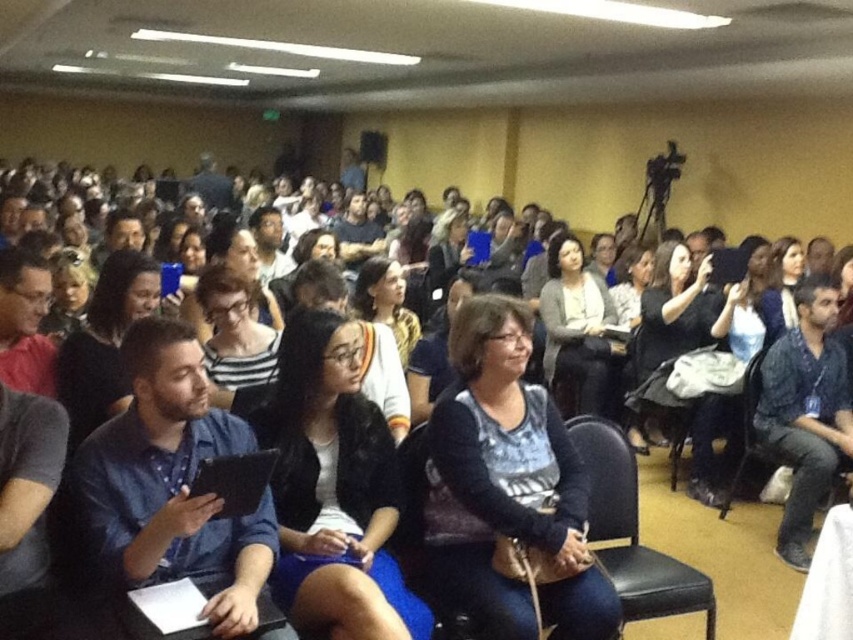
Question: Which of the following is the farthest from the observer?

Choices:
 (A) (651, 548)
 (B) (395, 324)
 (C) (109, 282)

Answer: (B)

Question: Is black fuzzy jacket at center positioned in front of black fabric at center?

Choices:
 (A) yes
 (B) no

Answer: (A)

Question: Which point is farther to the camera?

Choices:
 (A) (59, 381)
 (B) (207, 298)

Answer: (B)

Question: Which of the following is the closest to the observer?

Choices:
 (A) black fabric at center
 (B) dark gray sweater at center
 (C) striped shirt at center

Answer: (C)

Question: In this image, where is blue denim shirt at center located relative to black fabric at center?

Choices:
 (A) below
 (B) above

Answer: (A)

Question: Is black leather chair at center closer to camera compared to matte yellow sweater at center?

Choices:
 (A) yes
 (B) no

Answer: (A)